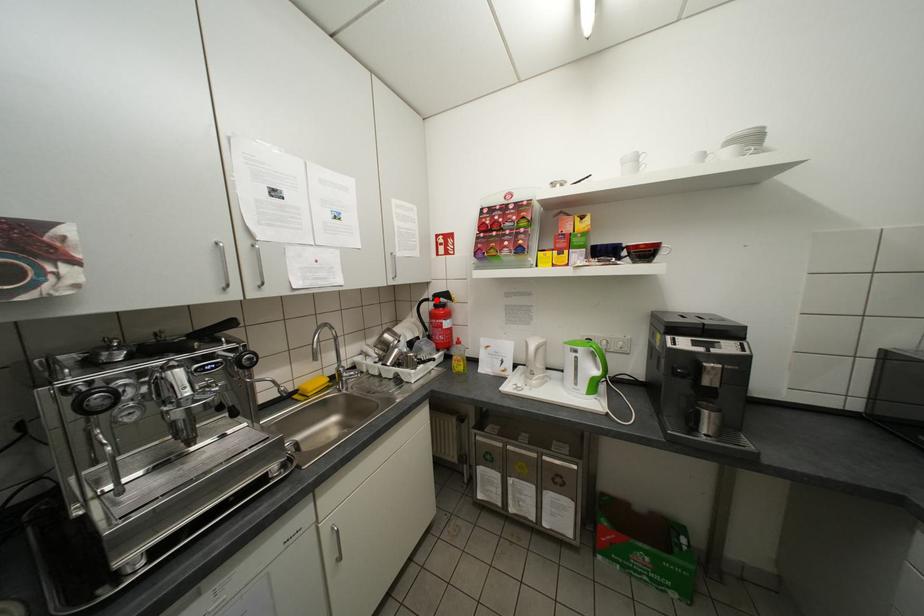
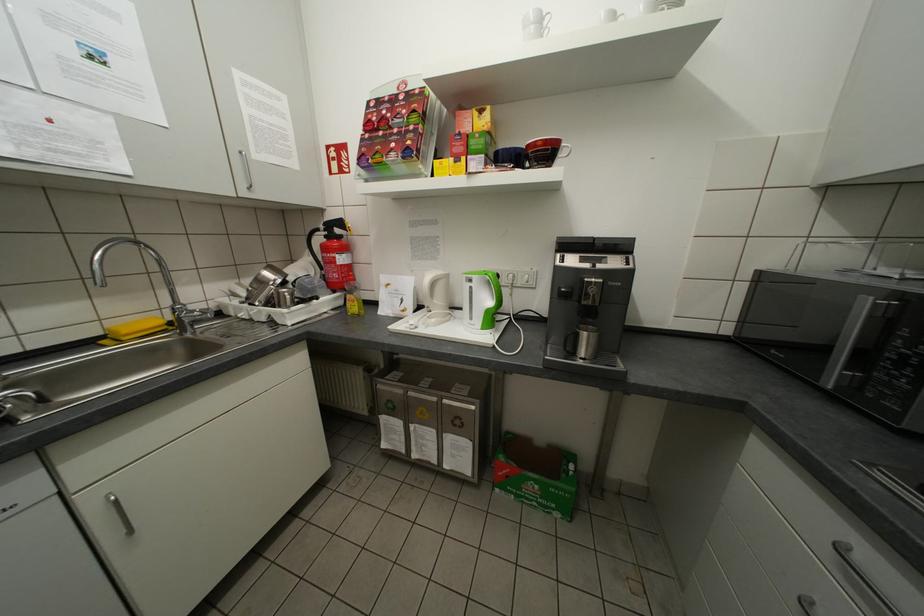
Locate, in the second image, the point that corresponds to the highlighted location in the first image.

(325, 230)